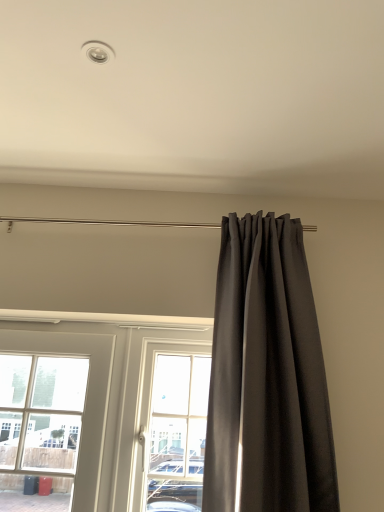
Question: Is point (213, 483) closer or farther from the camera than point (195, 407)?

Choices:
 (A) closer
 (B) farther

Answer: (A)

Question: Is dark gray fabric curtain at right to the left or to the right of clear glass door at center in the image?

Choices:
 (A) left
 (B) right

Answer: (B)

Question: In terms of width, does dark gray fabric curtain at right look wider or thinner when compared to clear glass door at center?

Choices:
 (A) thin
 (B) wide

Answer: (B)

Question: Is clear glass door at center wider or thinner than dark gray fabric curtain at right?

Choices:
 (A) thin
 (B) wide

Answer: (A)

Question: From their relative heights in the image, would you say clear glass door at center is taller or shorter than dark gray fabric curtain at right?

Choices:
 (A) tall
 (B) short

Answer: (B)

Question: Does point (160, 356) appear closer or farther from the camera than point (294, 400)?

Choices:
 (A) farther
 (B) closer

Answer: (A)

Question: Considering the positions of clear glass door at center and dark gray fabric curtain at right in the image, is clear glass door at center bigger or smaller than dark gray fabric curtain at right?

Choices:
 (A) small
 (B) big

Answer: (A)